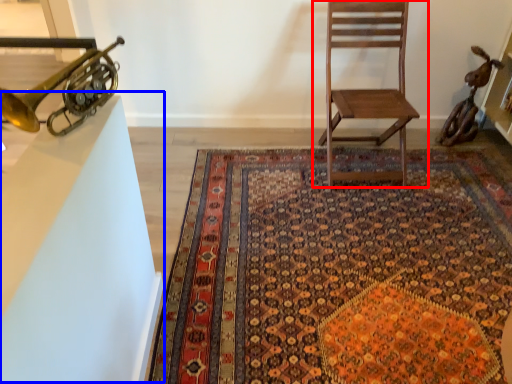
Question: Which of the following is the farthest to the observer, chair (highlighted by a red box) or table (highlighted by a blue box)?

Choices:
 (A) chair
 (B) table

Answer: (A)